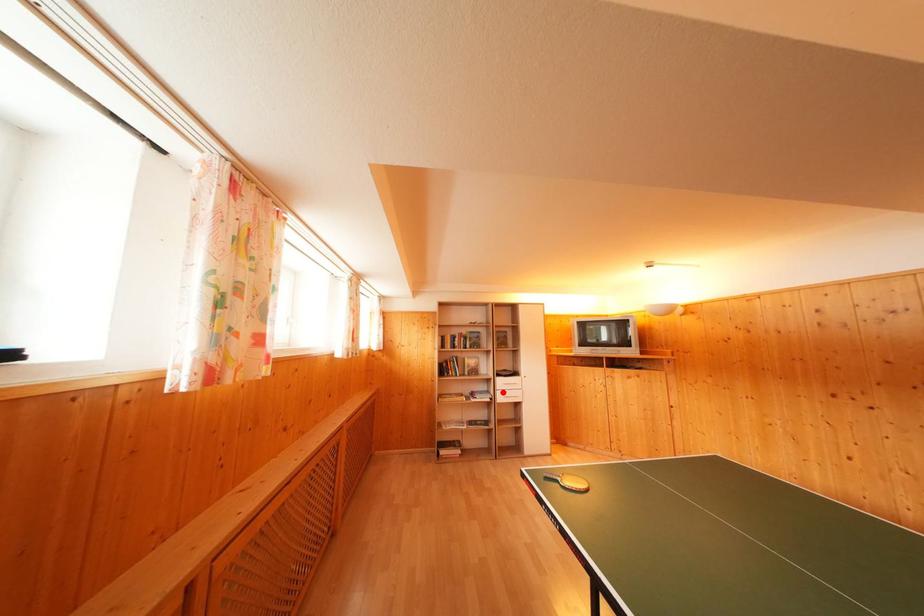
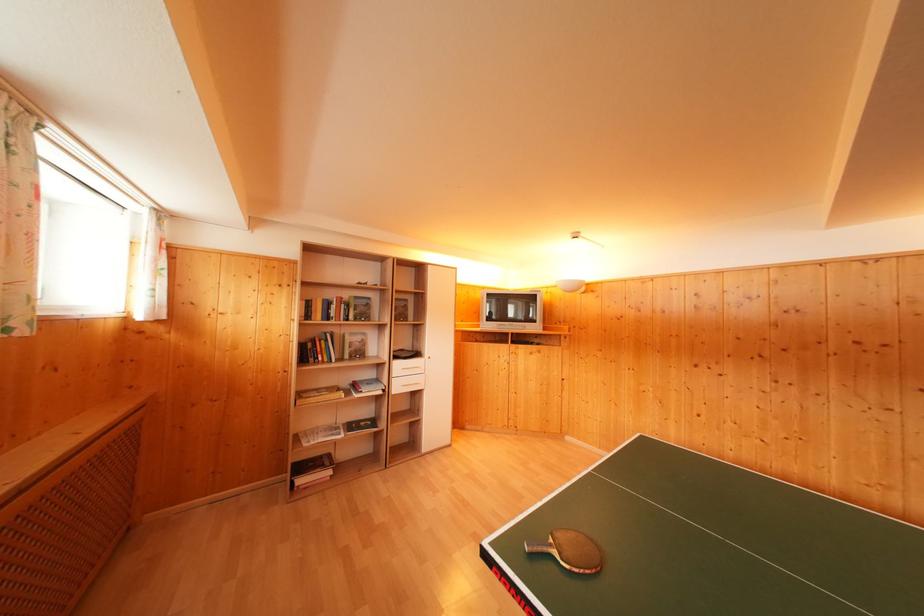
Where in the second image is the point corresponding to the highlighted location from the first image?

(398, 379)